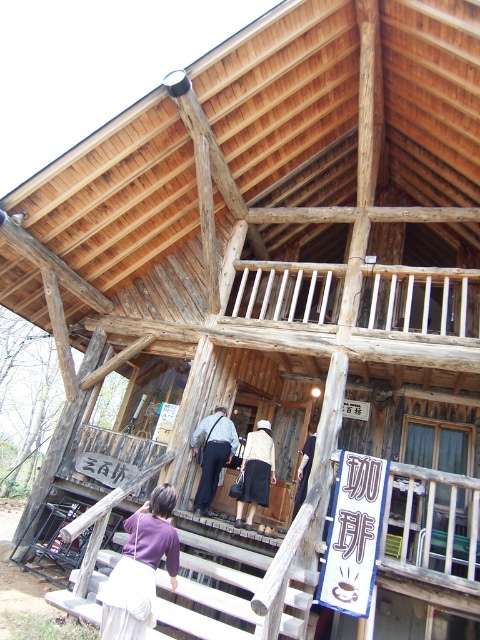
Looking at this image, you are standing in front of the rustic wooden building and want to reach the upper level. You notice a wooden stairs at center and a white cotton shirt at center. Which object should you use to ascend to the upper level?

The wooden stairs at center is closer to the viewer than the white cotton shirt at center, so you should use the wooden stairs at center to ascend to the upper level.

You are standing in front of the rustic wooden building and want to reach the upper level balcony. There is a wooden stairs at center and dark blue fabric pants at center in your way. Which object should you move around to access the stairs?

You should move around the dark blue fabric pants at center because the wooden stairs at center is closer to the viewer than the dark blue fabric pants at center, so the pants are in front of the stairs and need to be moved first.